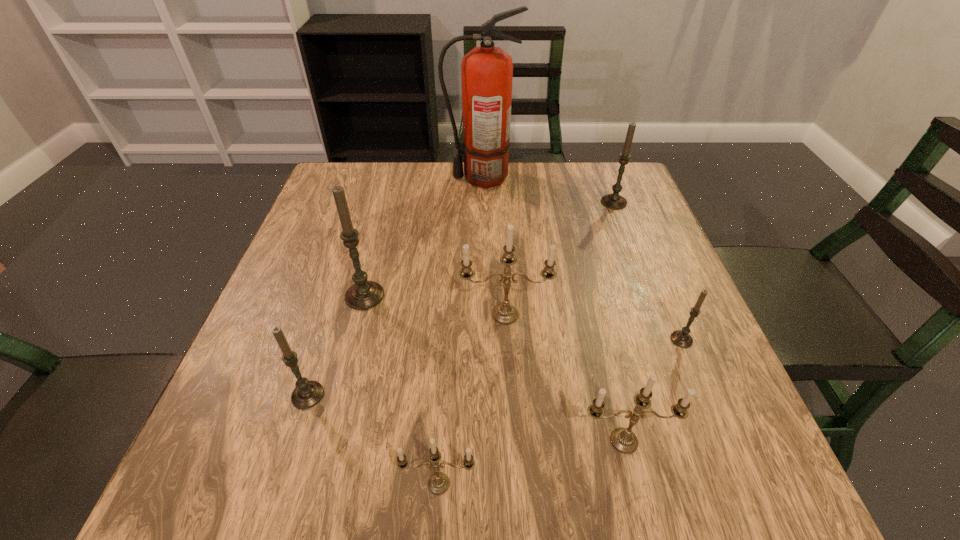
You are a GUI agent. You are given a task and a screenshot of the screen. Output one action in this format:
    pyautogui.click(x=<x>, y=<y>)
    Task: Click on the tallest object
    Image resolution: width=960 pixels, height=540 pixels.
    Given the screenshot: What is the action you would take?
    pyautogui.click(x=487, y=72)

You are a GUI agent. You are given a task and a screenshot of the screen. Output one action in this format:
    pyautogui.click(x=<x>, y=<y>)
    Task: Click on the fire extinguisher
    
    Given the screenshot: What is the action you would take?
    click(x=487, y=72)

This screenshot has width=960, height=540. In order to click on the tallest candle in this screenshot , I will do `click(362, 295)`.

Where is `the biggest gray candle`? The image size is (960, 540). the biggest gray candle is located at coordinates (362, 295).

Locate an element on the screen. This screenshot has width=960, height=540. the farthest gray candle is located at coordinates (615, 201).

I want to click on the farthest candle, so click(615, 201).

Find the location of a particular element. The width and height of the screenshot is (960, 540). the farthest metallic candle is located at coordinates (505, 313).

The width and height of the screenshot is (960, 540). I want to click on the third nearest candle, so click(x=307, y=394).

I want to click on the nearest gray candle, so click(307, 394).

Locate an element on the screen. the third candle from right to left is located at coordinates (622, 439).